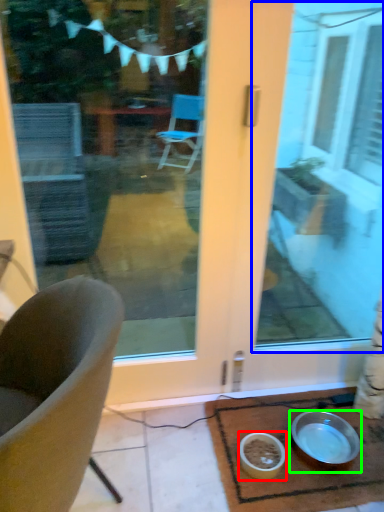
Question: Which is nearer to the bowl (highlighted by a red box)? window screen (highlighted by a blue box) or bowl (highlighted by a green box).

Choices:
 (A) window screen
 (B) bowl

Answer: (B)